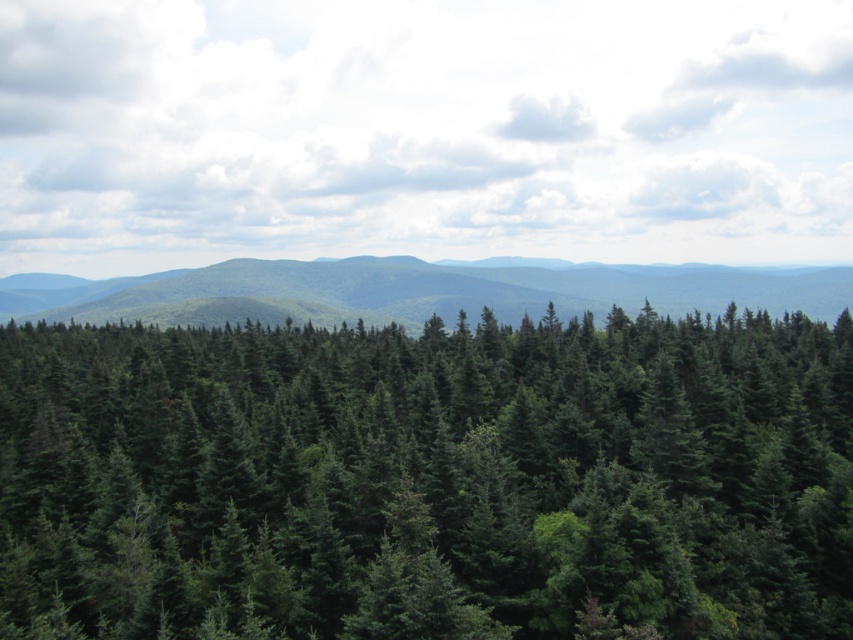
Is green matte pine forest at center further to the viewer compared to green matte forest at center?

No.

Is point (738, 401) farther from camera compared to point (624, 284)?

That is False.

I want to click on green matte pine forest at center, so click(428, 480).